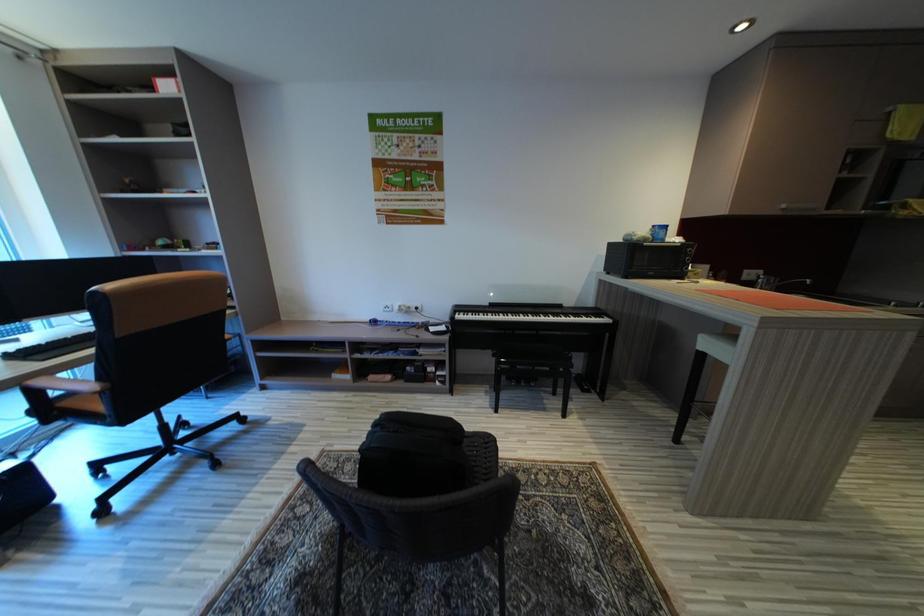
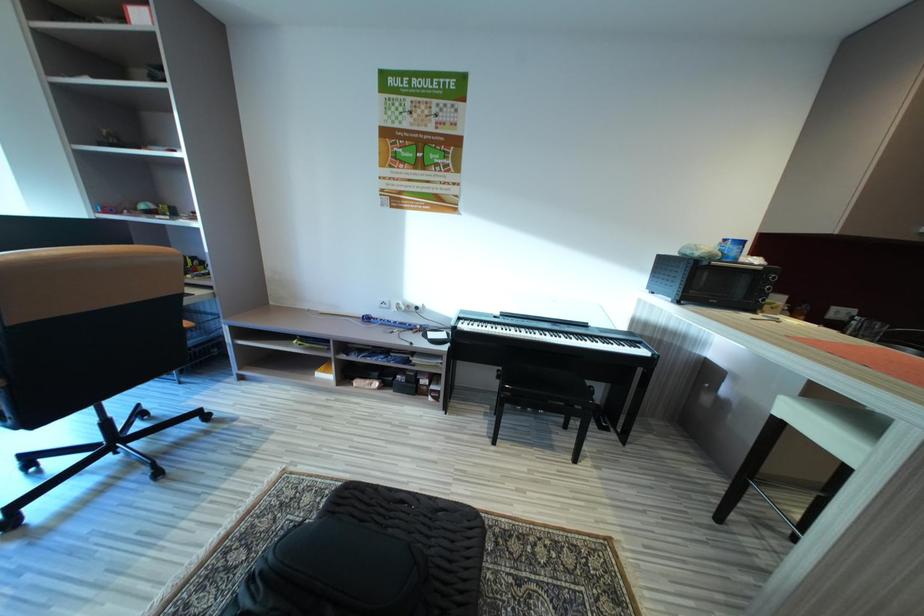
Question: Which direction would the cameraman need to move to produce the second image? Reply with the corresponding letter.

Choices:
 (A) Left
 (B) Right
 (C) Forward
 (D) Backward

Answer: (C)